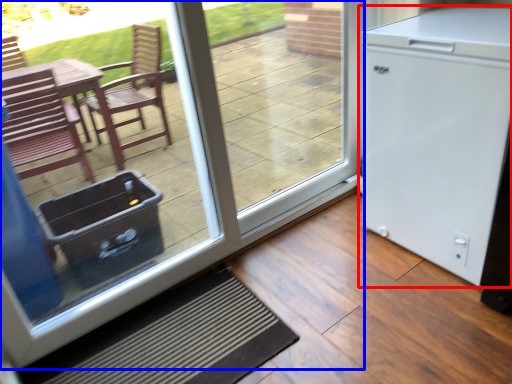
Question: Which point is further to the camera, refrigerator (highlighted by a red box) or door (highlighted by a blue box)?

Choices:
 (A) refrigerator
 (B) door

Answer: (A)